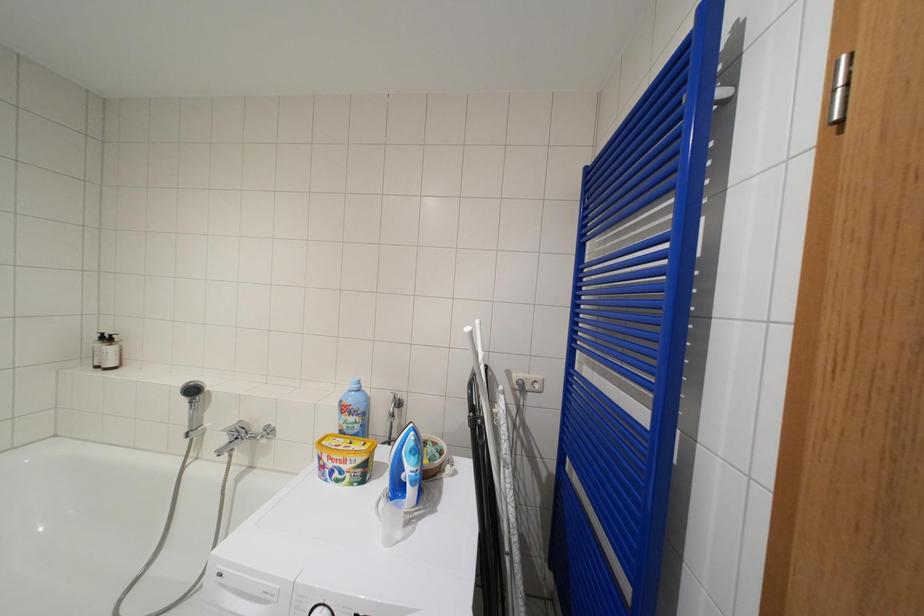
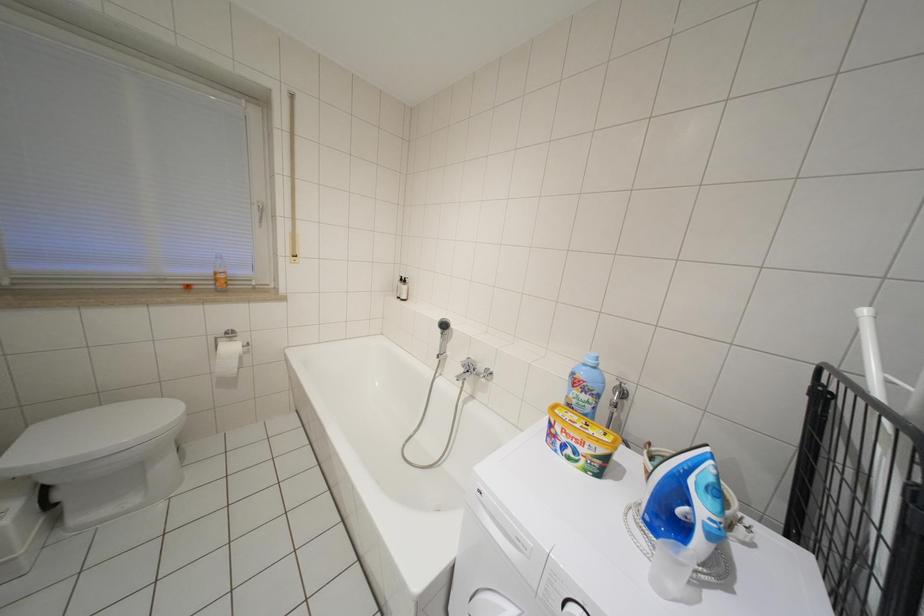
Question: The images are taken continuously from a first-person perspective. In which direction is your viewpoint rotating?

Choices:
 (A) Left
 (B) Right
 (C) Up
 (D) Down

Answer: (A)